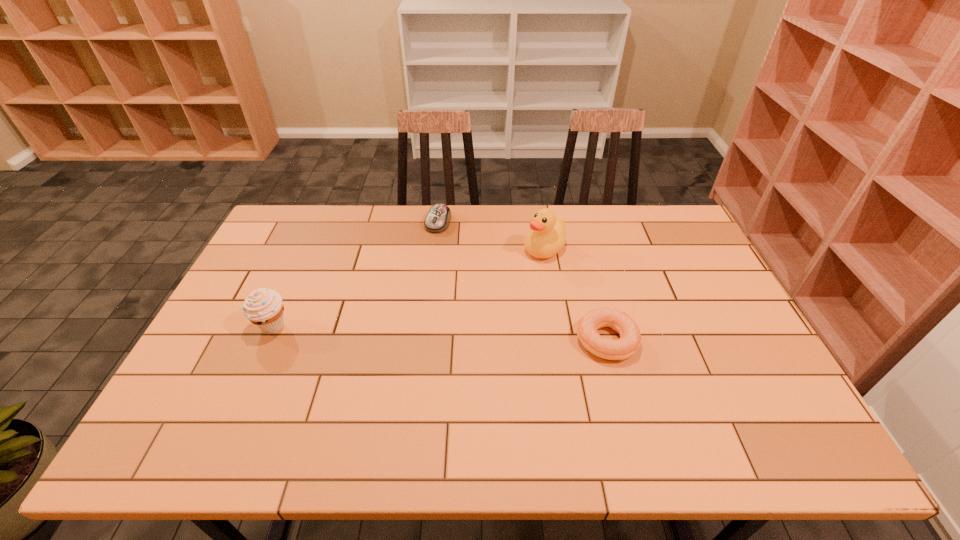
Find the location of a particular element. unoccupied area between the computer mouse and the duck is located at coordinates (492, 236).

Find the location of `free space that is in between the bagel and the tallest object`. free space that is in between the bagel and the tallest object is located at coordinates (575, 295).

Locate an element on the screen. This screenshot has width=960, height=540. vacant point located between the third nearest object and the farthest object is located at coordinates (492, 236).

This screenshot has height=540, width=960. I want to click on object that is the closest to the third shortest object, so click(437, 220).

Locate which object ranks in proximity to the leftmost object. Please provide its 2D coordinates. Your answer should be formatted as a tuple, i.e. [(x, y)], where the tuple contains the x and y coordinates of a point satisfying the conditions above.

[(437, 220)]

At what (x,y) coordinates should I click in order to perform the action: click on free space that satisfies the following two spatial constraints: 1. on the front side of the second farthest object; 2. on the right side of the bagel. Please return your answer as a coordinate pair (x, y). The height and width of the screenshot is (540, 960). Looking at the image, I should click on (559, 340).